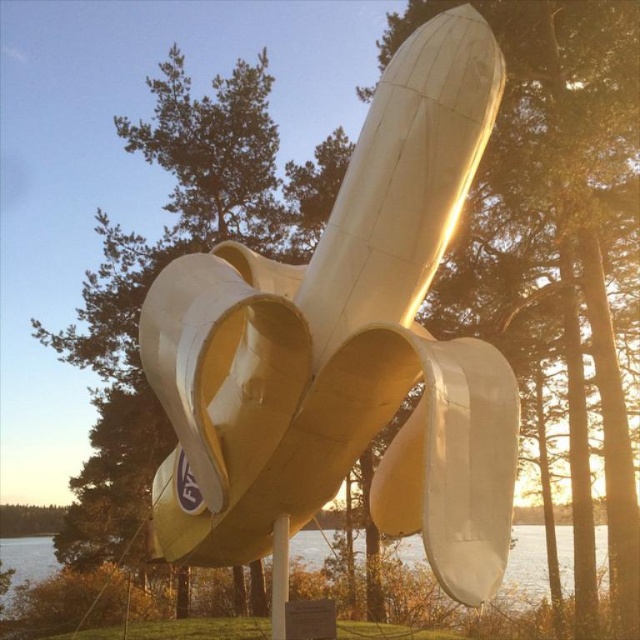
Question: Can you confirm if gold metallic sculpture at center is positioned to the right of matte white sculpture at upper center?

Choices:
 (A) yes
 (B) no

Answer: (B)

Question: Which point appears farthest from the camera in this image?

Choices:
 (A) (221, 150)
 (B) (618, 58)
 (C) (355, 422)

Answer: (A)

Question: Can you confirm if matte white sculpture at upper center is positioned above green leafy tree at center?

Choices:
 (A) no
 (B) yes

Answer: (B)

Question: Among these objects, which one is nearest to the camera?

Choices:
 (A) gold metallic sculpture at center
 (B) green leafy tree at center
 (C) matte white sculpture at upper center

Answer: (A)

Question: Is gold metallic sculpture at center behind matte white sculpture at upper center?

Choices:
 (A) yes
 (B) no

Answer: (B)

Question: Which object appears closest to the camera in this image?

Choices:
 (A) matte white sculpture at upper center
 (B) gold metallic sculpture at center
 (C) green leafy tree at center

Answer: (B)